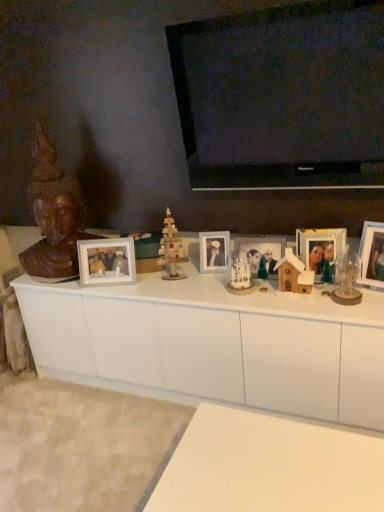
Where is `free point to the right of wooden christmas tree at center, which is counted as the third toy, starting from the right`? This screenshot has height=512, width=384. free point to the right of wooden christmas tree at center, which is counted as the third toy, starting from the right is located at coordinates (204, 278).